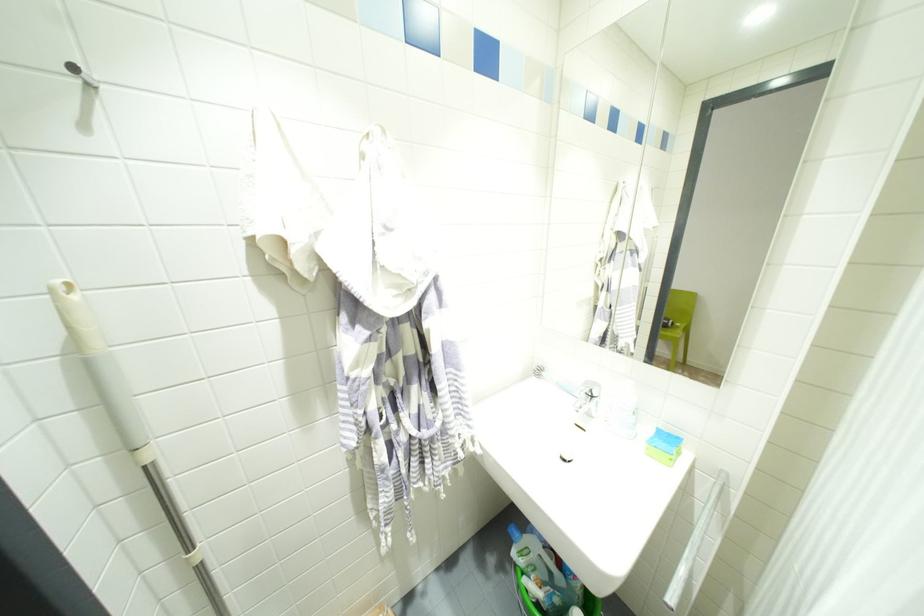
The image size is (924, 616). Describe the element at coordinates (673, 329) in the screenshot. I see `the green chair sitting surface` at that location.